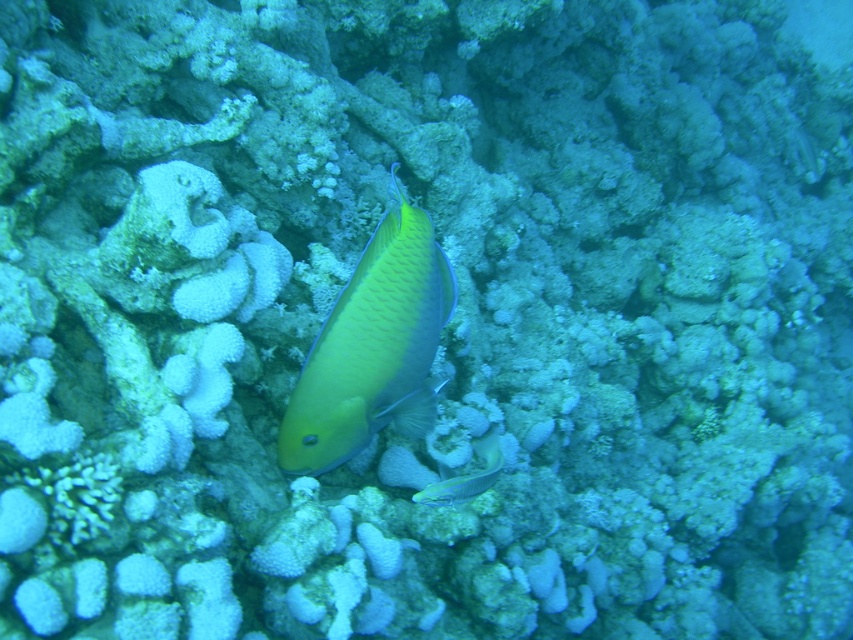
You are a marine biologist observing an underwater scene with a yellow matte fish at center and a shiny blue fish at center. Which fish is located above the other?

The yellow matte fish at center is positioned over the shiny blue fish at center, meaning it is above the other fish.